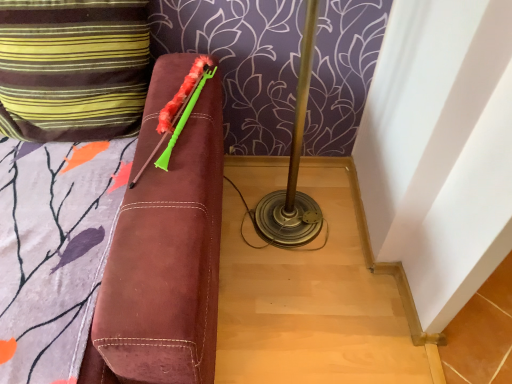
Question: Should I look upward or downward to see striped fabric pillow at upper left?

Choices:
 (A) down
 (B) up

Answer: (B)